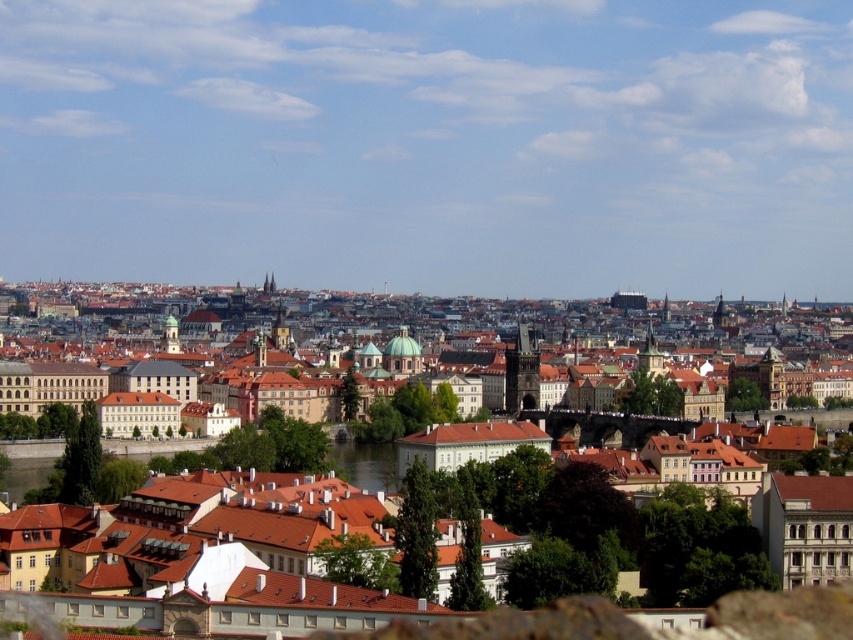
From the picture: You are a tourist standing at the edge of the city, looking towards the historic bridge. You see the brown stone buildings at center and the greenish water at center. Which one is positioned higher in the image?

The brown stone buildings at center are positioned higher than the greenish water at center in the image.

You are standing at the point marked as point [334,314] in the city map. What is the nearest landmark to your current location?

The nearest landmark to point [334,314] is the brown stone buildings at center located at that point.